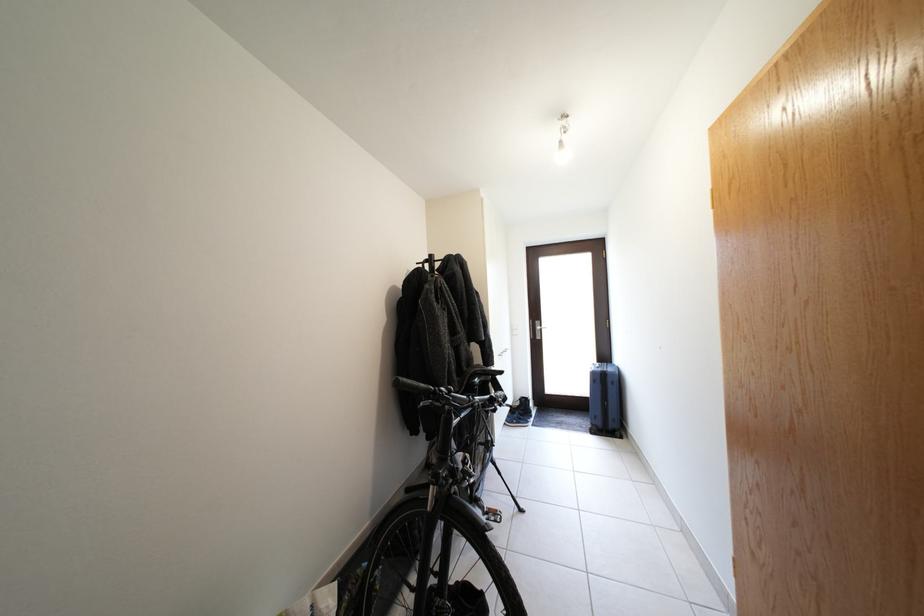
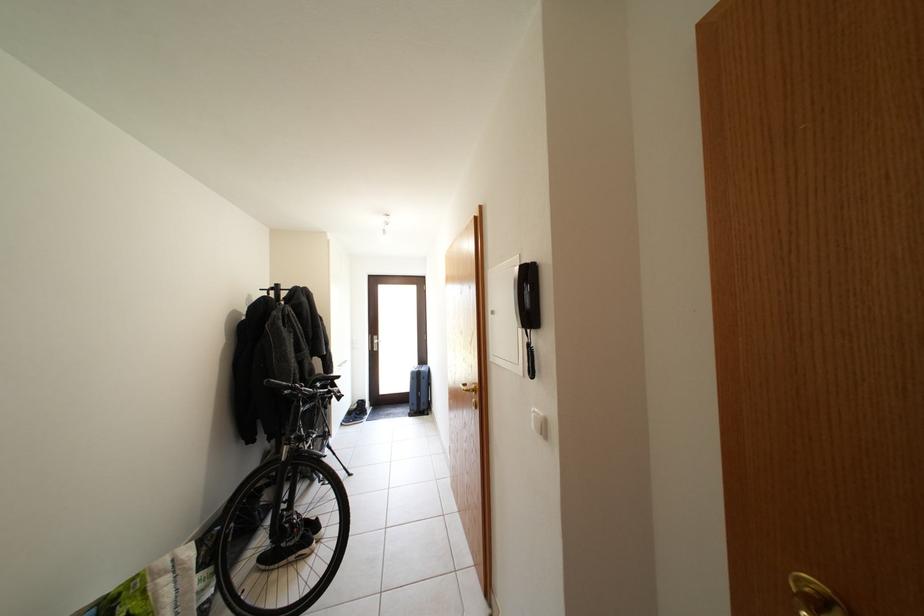
Where in the second image is the point corresponding to pixel 426 392 from the first image?

(289, 390)